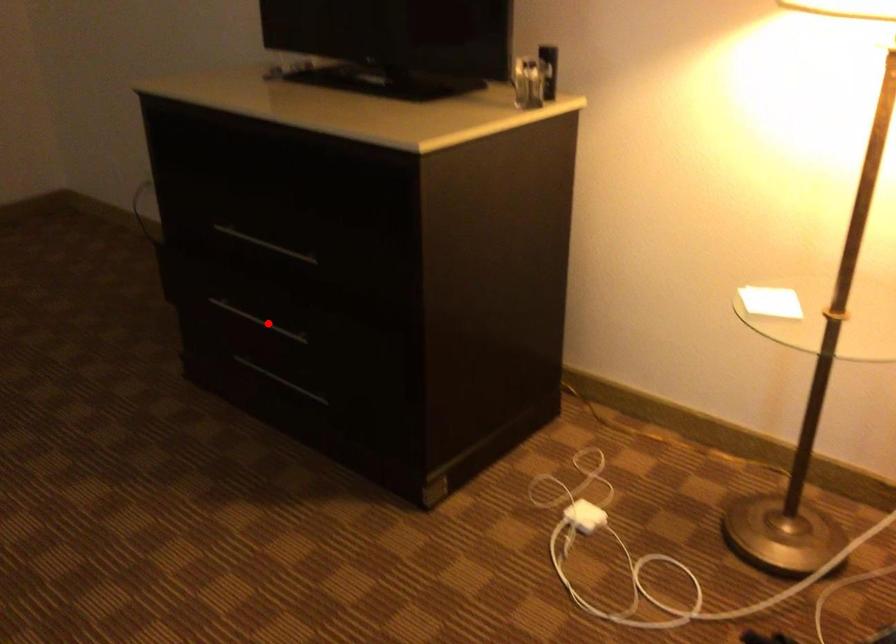
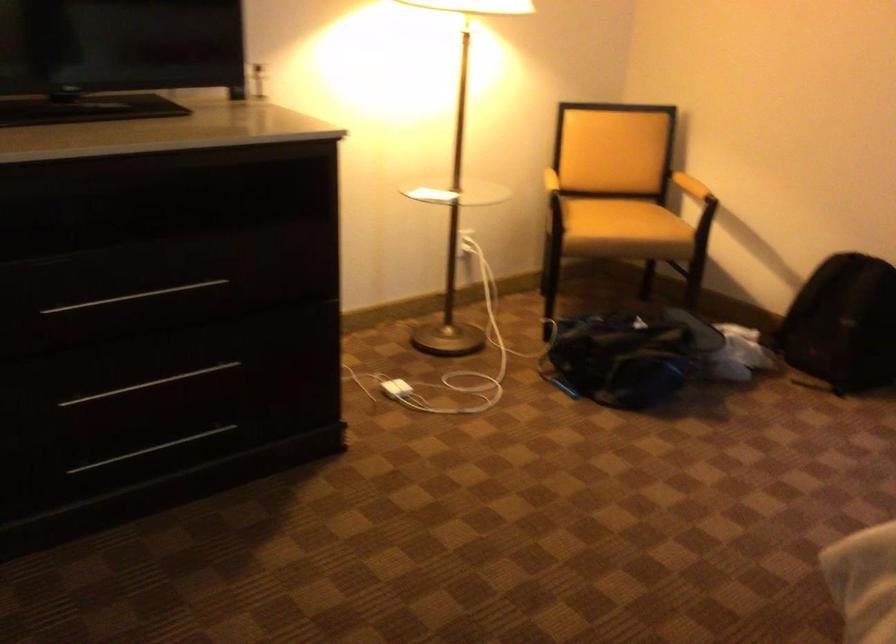
Question: I am providing you with two images of the same scene from different viewpoints. In image1, a red point is highlighted. Considering the same 3D point in image2, which of the following is correct?

Choices:
 (A) It is closer
 (B) It is farther

Answer: (A)